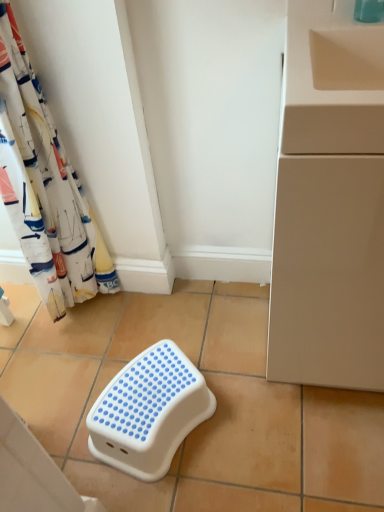
Find the location of a particular element. Image resolution: width=384 pixels, height=512 pixels. unoccupied region to the right of beige ceramic tile at lower left, placed as the 1th ceramic tile when sorted from left to right is located at coordinates (82, 432).